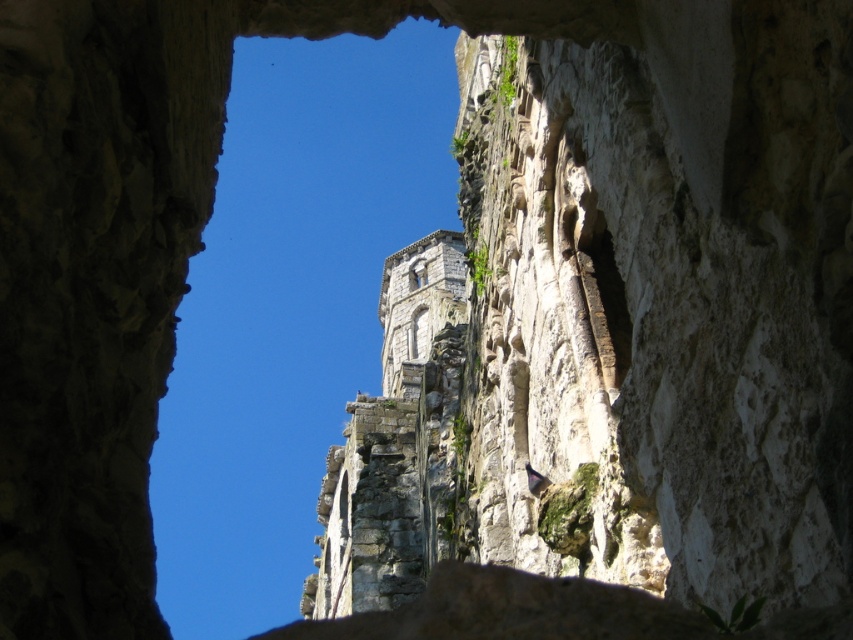
You are standing in front of the stone archway and want to take a photo of the gray stone tower at center. To ensure the tower is centered in your photo, where should you aim your camera? Specify the coordinates based on the image grid where the center of the image is at point 0.5, 0.5.

The gray stone tower at center is positioned at coordinates (418,307), which is very close to the center point of the image grid. To center the tower in your photo, aim your camera slightly to the left and down from the exact center point.

You are an architect planning to install a new decorative element. You have two options to choose from. The first is a small statue that must fit within the space of the clear glass window at center. The second is a large sculpture that must fit within the space of the gray stone tower at center. Based on their sizes, which decorative element should you choose for each location?

The gray stone tower at center is larger in size than the clear glass window at center, so the large sculpture should be placed within the gray stone tower at center and the small statue should be placed within the clear glass window at center.

In the scene shown: You are standing in front of a historic stone structure and want to take a photo of a specific point located at coordinates point [381,387]. If your camera has a maximum focus range of 300 meters, will it be able to focus on that point?

The distance of point [381,387] from camera is 302.59 meters, which exceeds the camera maximum focus range of 300 meters. Therefore, the camera cannot focus on that point.